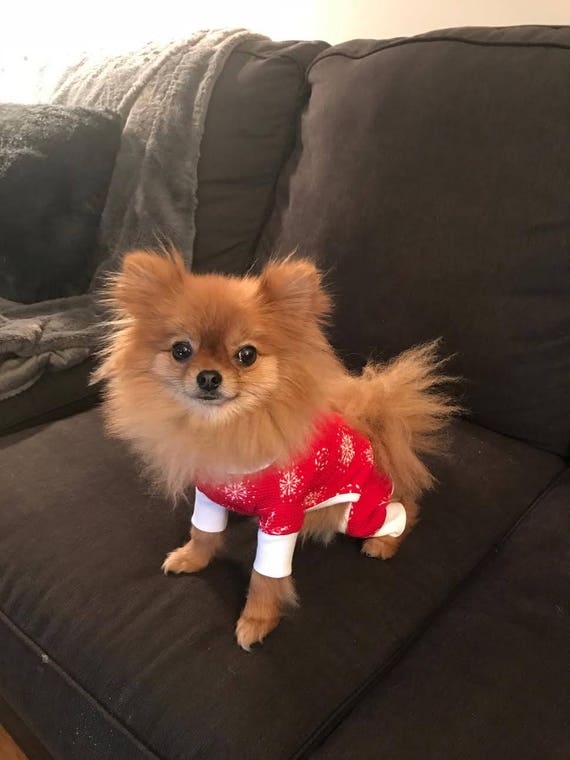
The width and height of the screenshot is (570, 760). I want to click on dog sitting on sofa, so click(307, 483).